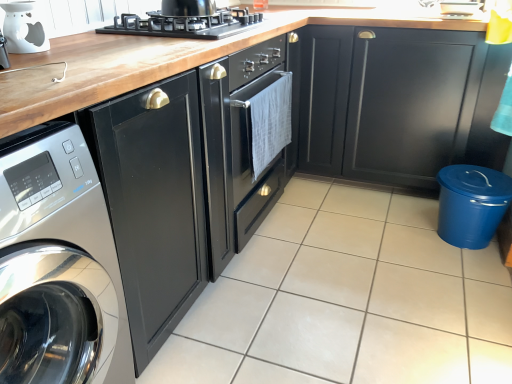
Question: Should I look upward or downward to see matte black cabinet at lower right, the 1th cabinetry viewed from the right?

Choices:
 (A) down
 (B) up

Answer: (B)

Question: From a real-world perspective, is white glossy tile at center physically below black matte gas stove at upper center?

Choices:
 (A) yes
 (B) no

Answer: (A)

Question: Is white glossy tile at center positioned behind black matte gas stove at upper center?

Choices:
 (A) yes
 (B) no

Answer: (B)

Question: Can you see white glossy tile at center touching black matte gas stove at upper center?

Choices:
 (A) no
 (B) yes

Answer: (A)

Question: Does white glossy tile at center have a greater width compared to black matte gas stove at upper center?

Choices:
 (A) yes
 (B) no

Answer: (A)

Question: Is white glossy tile at center bigger than black matte gas stove at upper center?

Choices:
 (A) no
 (B) yes

Answer: (B)

Question: Is white glossy tile at center aimed at black matte gas stove at upper center?

Choices:
 (A) yes
 (B) no

Answer: (B)

Question: Can you confirm if black matte gas stove at upper center is wider than matte black cabinet at lower right, the 1th cabinetry viewed from the right?

Choices:
 (A) yes
 (B) no

Answer: (B)

Question: Considering the relative sizes of black matte gas stove at upper center and matte black cabinet at lower right, the 1th cabinetry viewed from the right, in the image provided, is black matte gas stove at upper center smaller than matte black cabinet at lower right, the 1th cabinetry viewed from the right,?

Choices:
 (A) yes
 (B) no

Answer: (A)

Question: Does black matte gas stove at upper center have a greater height compared to matte black cabinet at lower right, which is the second cabinetry from left to right?

Choices:
 (A) no
 (B) yes

Answer: (A)

Question: Considering the relative sizes of black matte gas stove at upper center and matte black cabinet at lower right, which is the second cabinetry from left to right, in the image provided, is black matte gas stove at upper center bigger than matte black cabinet at lower right, which is the second cabinetry from left to right,?

Choices:
 (A) yes
 (B) no

Answer: (B)

Question: From the image's perspective, is black matte gas stove at upper center over matte black cabinet at lower right, which is the second cabinetry from left to right?

Choices:
 (A) yes
 (B) no

Answer: (A)

Question: Does black matte gas stove at upper center turn towards matte black cabinet at lower right, which is the second cabinetry from left to right?

Choices:
 (A) no
 (B) yes

Answer: (A)

Question: From the image's perspective, would you say satin silver washing machine at left is shown under glossy black cabinet at center, marked as the 2th cabinetry in a right-to-left arrangement?

Choices:
 (A) no
 (B) yes

Answer: (B)